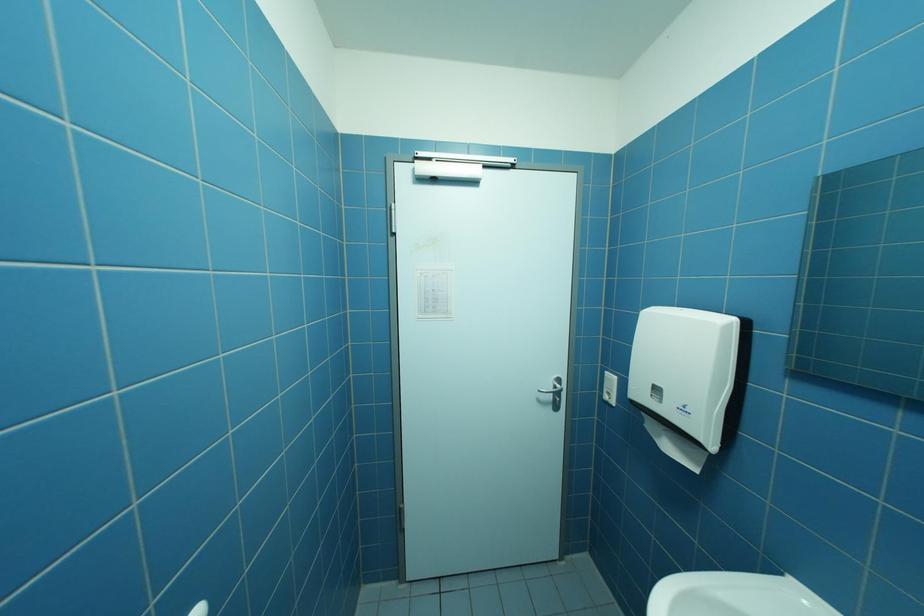
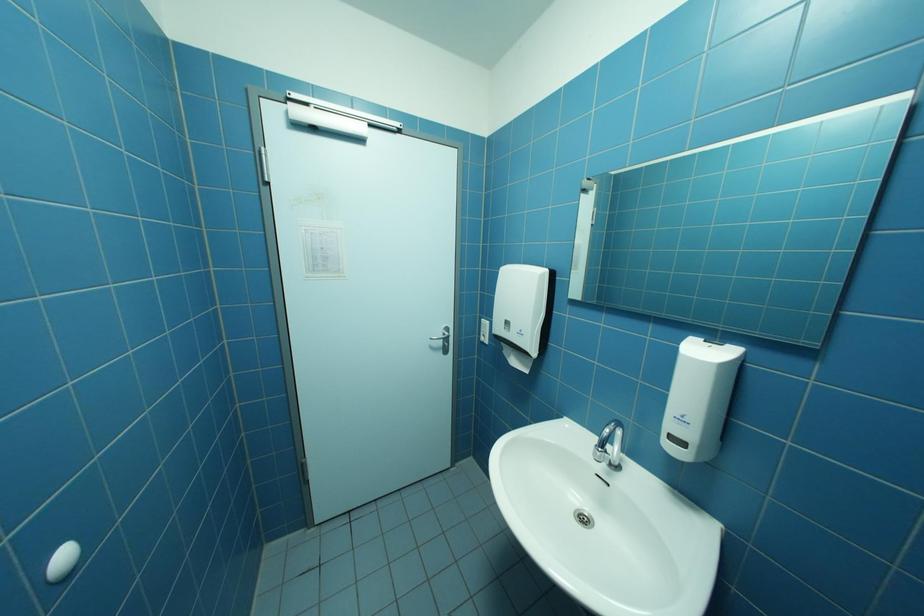
Question: The camera is either moving clockwise (left) or counter-clockwise (right) around the object. The first image is from the beginning of the video and the second image is from the end. Is the camera moving left or right when shooting the video?

Choices:
 (A) Left
 (B) Right

Answer: (A)